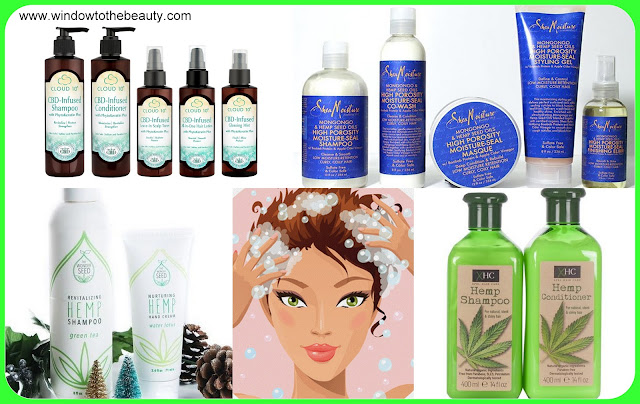
You are a GUI agent. You are given a task and a screenshot of the screen. Output one action in this format:
    pyautogui.click(x=<x>, y=<y>)
    Task: Click on the spray bottles
    
    Given the screenshot: What is the action you would take?
    pyautogui.click(x=188, y=131), pyautogui.click(x=224, y=129), pyautogui.click(x=148, y=114), pyautogui.click(x=598, y=118)